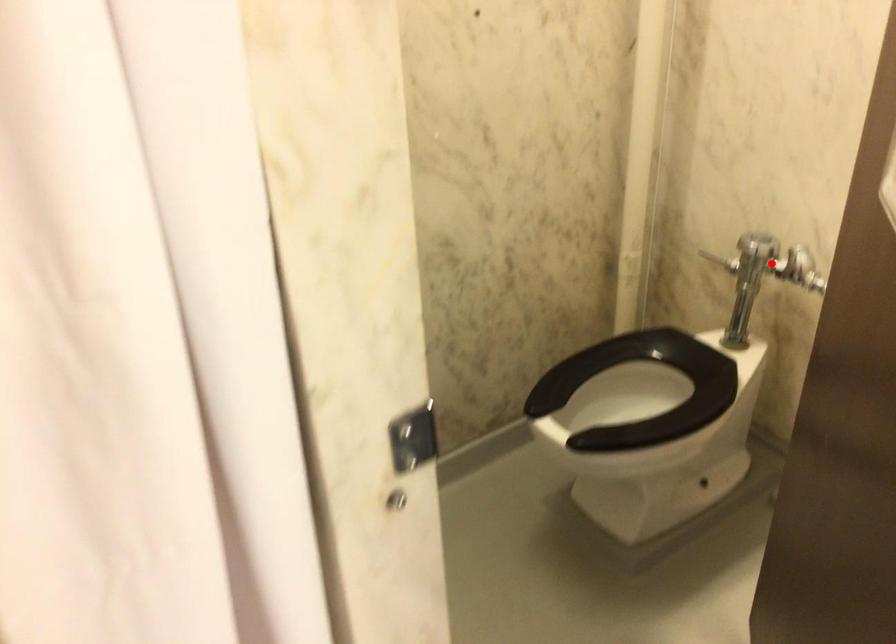
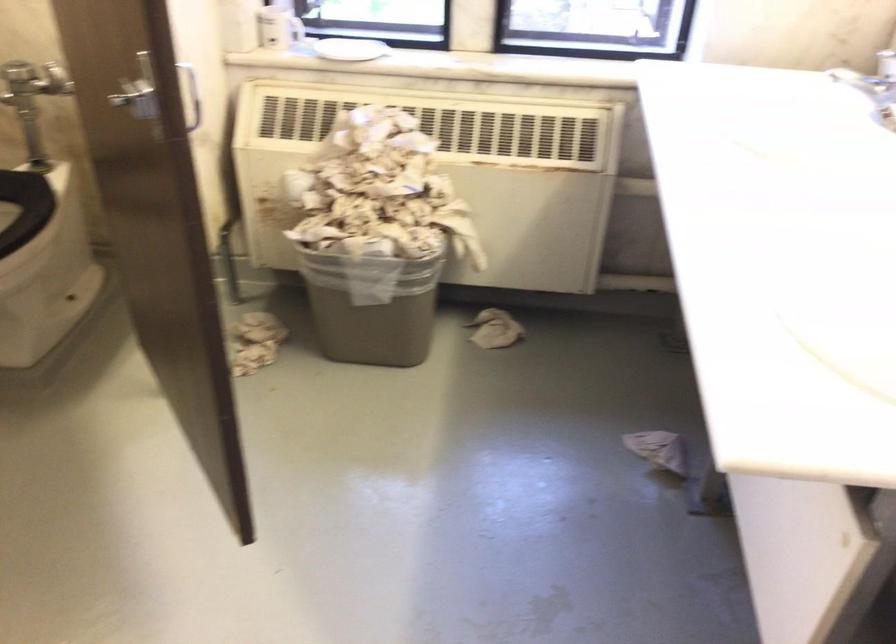
The point at the highlighted location is marked in the first image. Where is the corresponding point in the second image?

(32, 80)